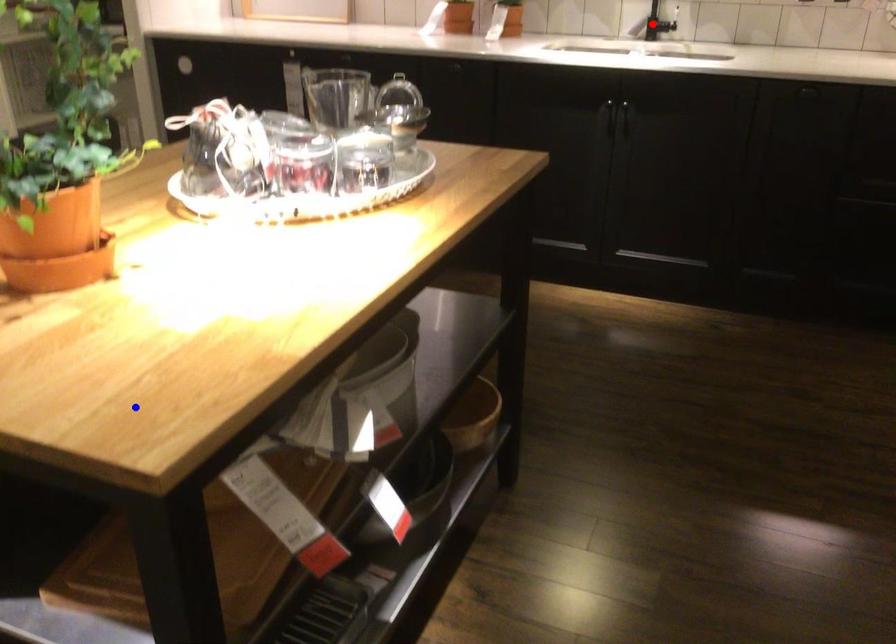
Question: Which of the two points in the image is closer to the camera?

Choices:
 (A) Blue point is closer.
 (B) Red point is closer.

Answer: (A)